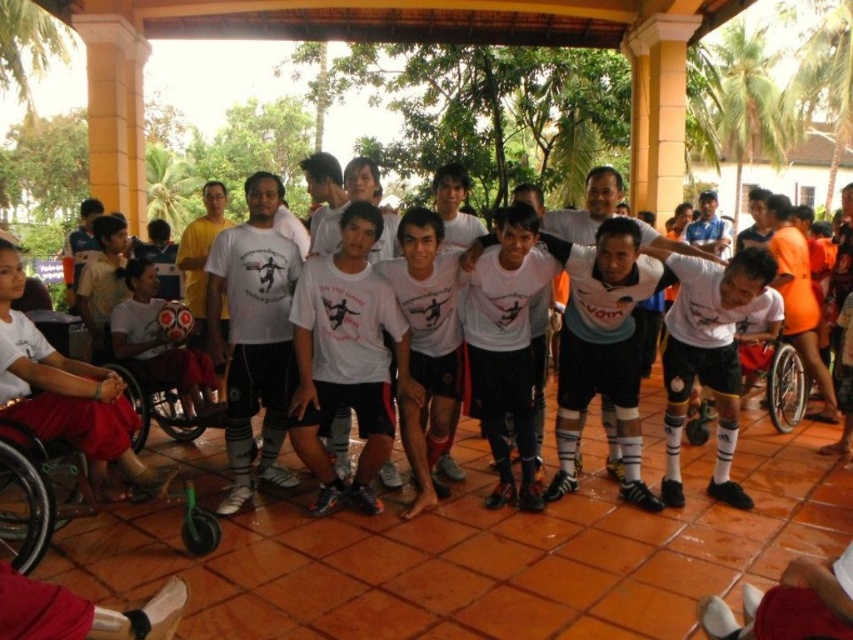
Image resolution: width=853 pixels, height=640 pixels. What do you see at coordinates (32, 493) in the screenshot? I see `black plastic wheelchair at lower left` at bounding box center [32, 493].

Which of these two, black plastic wheelchair at lower left or silver metallic wheelchair at center, stands shorter?

black plastic wheelchair at lower left

This screenshot has height=640, width=853. I want to click on black plastic wheelchair at lower left, so click(32, 493).

Between matte white shirt at left and black plastic wheelchair at lower left, which one appears on the left side from the viewer's perspective?

Positioned to the left is matte white shirt at left.

Between matte white shirt at left and black plastic wheelchair at lower left, which one appears on the right side from the viewer's perspective?

Positioned to the right is black plastic wheelchair at lower left.

Which is in front, point (152, 310) or point (9, 465)?

Point (9, 465) is in front.

Find the location of a particular element. This screenshot has height=640, width=853. matte white shirt at left is located at coordinates (161, 342).

The height and width of the screenshot is (640, 853). What do you see at coordinates (347, 356) in the screenshot?
I see `white matte jersey at center` at bounding box center [347, 356].

Is point (366, 413) closer to viewer compared to point (13, 420)?

No, it is not.

Identify the location of white matte jersey at center. The width and height of the screenshot is (853, 640). (347, 356).

Where is `white matte jersey at center`? This screenshot has height=640, width=853. white matte jersey at center is located at coordinates (x=347, y=356).